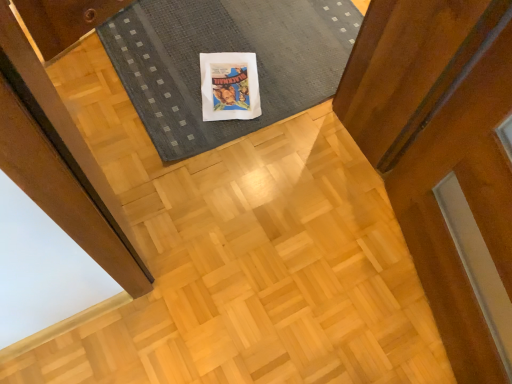
Question: From a real-world perspective, is dark gray textured mat at center under matte white comic book at center?

Choices:
 (A) no
 (B) yes

Answer: (A)

Question: Is dark gray textured mat at center to the right of matte white comic book at center from the viewer's perspective?

Choices:
 (A) no
 (B) yes

Answer: (B)

Question: Considering the relative sizes of dark gray textured mat at center and matte white comic book at center in the image provided, is dark gray textured mat at center wider than matte white comic book at center?

Choices:
 (A) no
 (B) yes

Answer: (B)

Question: Is matte white comic book at center completely or partially inside dark gray textured mat at center?

Choices:
 (A) no
 (B) yes

Answer: (B)

Question: Is dark gray textured mat at center next to matte white comic book at center and touching it?

Choices:
 (A) yes
 (B) no

Answer: (B)

Question: Is the depth of dark gray textured mat at center less than that of matte white comic book at center?

Choices:
 (A) no
 (B) yes

Answer: (B)

Question: Is matte white comic book at center positioned far away from dark gray textured mat at center?

Choices:
 (A) no
 (B) yes

Answer: (A)

Question: Is matte white comic book at center smaller than dark gray textured mat at center?

Choices:
 (A) yes
 (B) no

Answer: (A)

Question: Can we say matte white comic book at center lies outside dark gray textured mat at center?

Choices:
 (A) yes
 (B) no

Answer: (B)

Question: Can you confirm if matte white comic book at center is thinner than dark gray textured mat at center?

Choices:
 (A) yes
 (B) no

Answer: (A)

Question: Is matte white comic book at center further to camera compared to dark gray textured mat at center?

Choices:
 (A) no
 (B) yes

Answer: (B)

Question: Is matte white comic book at center oriented towards dark gray textured mat at center?

Choices:
 (A) yes
 (B) no

Answer: (A)

Question: From their relative heights in the image, would you say matte white comic book at center is taller or shorter than dark gray textured mat at center?

Choices:
 (A) tall
 (B) short

Answer: (B)